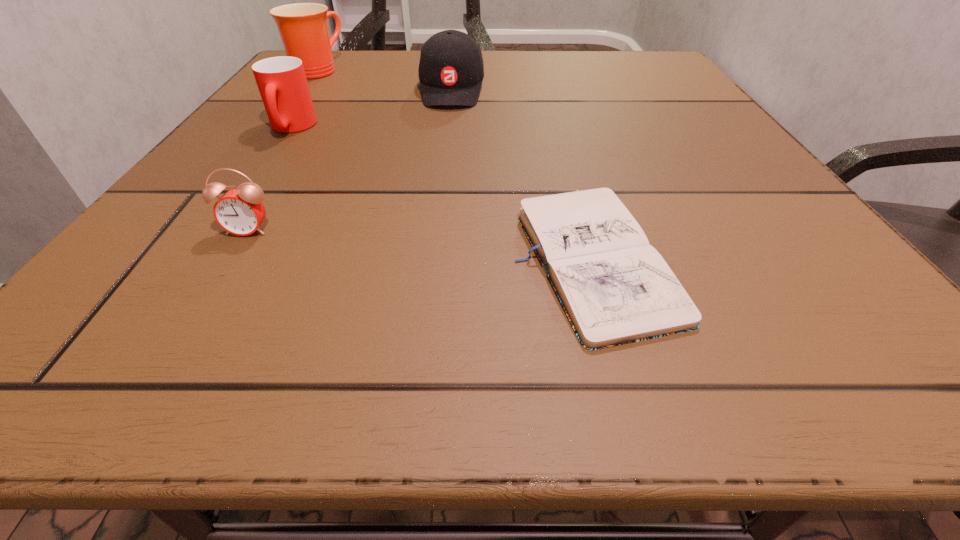
In the image, there is a desktop. Identify the location of vacant area at the right edge. (682, 217).

What are the coordinates of `vacant space at the far right corner of the desktop` in the screenshot? It's located at (645, 68).

Where is `free space at the near right corner of the desktop`? free space at the near right corner of the desktop is located at coordinates (775, 309).

Identify the location of vacant space in between the shortest object and the second object from right to left. (521, 172).

I want to click on free spot between the taller cup and the baseball cap, so click(x=384, y=80).

This screenshot has height=540, width=960. I want to click on unoccupied area between the rightmost object and the second object from right to left, so click(521, 172).

You are a GUI agent. You are given a task and a screenshot of the screen. Output one action in this format:
    pyautogui.click(x=<x>, y=<y>)
    Task: Click on the vacant area that lies between the fourth object from left to right and the alarm clock
    The width and height of the screenshot is (960, 540).
    Given the screenshot: What is the action you would take?
    pyautogui.click(x=350, y=160)

This screenshot has height=540, width=960. Identify the location of vacant region between the notebook and the taller cup. (454, 163).

The image size is (960, 540). In order to click on free spot between the alarm clock and the tallest object in this screenshot , I will do `click(282, 150)`.

Identify the location of free spot between the baseball cap and the second shortest object. (350, 160).